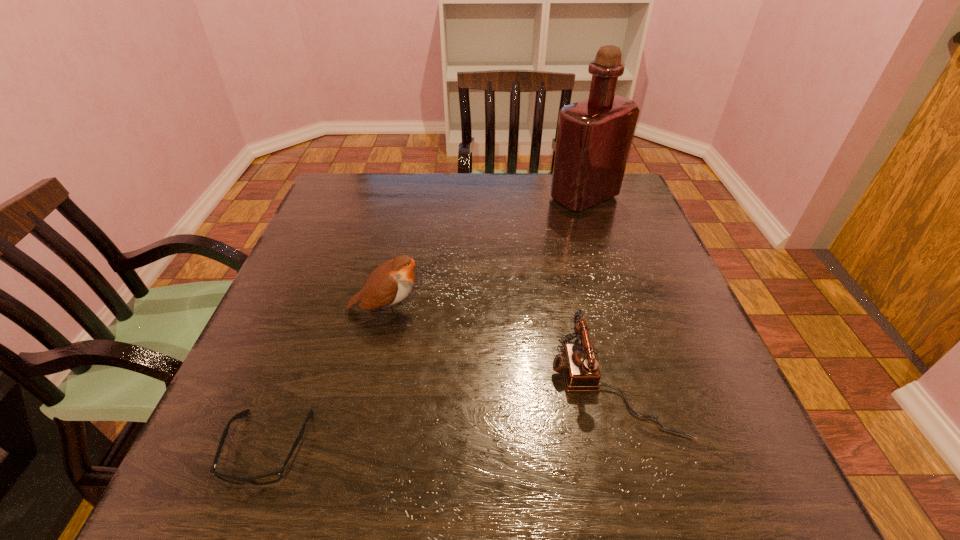
Where is `free space located on the dial of the second shortest object`? This screenshot has width=960, height=540. free space located on the dial of the second shortest object is located at coordinates (469, 384).

Where is `object that is positioned at the far edge`? Image resolution: width=960 pixels, height=540 pixels. object that is positioned at the far edge is located at coordinates (594, 136).

Locate an element on the screen. object at the near edge is located at coordinates (270, 478).

In order to click on bird that is at the left edge in this screenshot , I will do `click(390, 283)`.

This screenshot has width=960, height=540. I want to click on spectacles at the left edge, so click(x=270, y=478).

Where is `liquor that is at the right edge`? liquor that is at the right edge is located at coordinates (594, 136).

Where is `telephone situated at the right edge`? This screenshot has width=960, height=540. telephone situated at the right edge is located at coordinates (578, 363).

Locate an element on the screen. This screenshot has height=540, width=960. object that is positioned at the near left corner is located at coordinates (270, 478).

I want to click on object located in the far right corner section of the desktop, so click(594, 136).

This screenshot has height=540, width=960. Find the location of `vacant position at the far edge of the desktop`. vacant position at the far edge of the desktop is located at coordinates point(441,203).